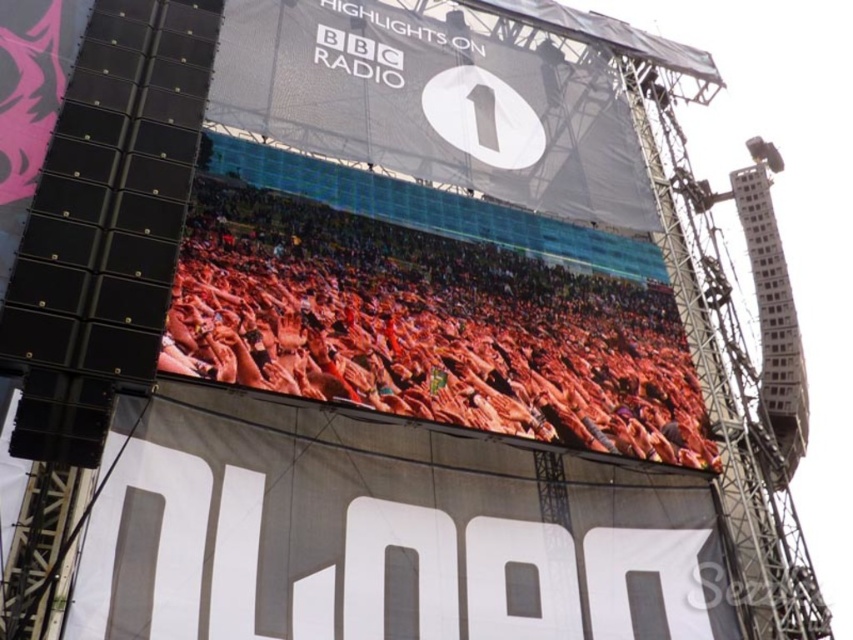
Between white matte sign at center and white fabric billboard at upper center, which one appears on the left side from the viewer's perspective?

white matte sign at center is more to the left.

Is white matte sign at center to the left of white fabric billboard at upper center from the viewer's perspective?

Yes, white matte sign at center is to the left of white fabric billboard at upper center.

Measure the distance between white matte sign at center and camera.

35.71 meters

The image size is (853, 640). I want to click on white matte sign at center, so (379, 532).

Is orange fabric crowd at center positioned before white fabric billboard at upper center?

Yes, it is in front of white fabric billboard at upper center.

Is point (316, 300) positioned before point (360, 161)?

Yes, point (316, 300) is in front of point (360, 161).

The width and height of the screenshot is (853, 640). I want to click on orange fabric crowd at center, so click(428, 328).

This screenshot has width=853, height=640. Identify the location of white matte sign at center. (379, 532).

Who is positioned more to the right, white matte sign at center or orange fabric crowd at center?

orange fabric crowd at center

Find the location of `white matte sign at center`. white matte sign at center is located at coordinates (379, 532).